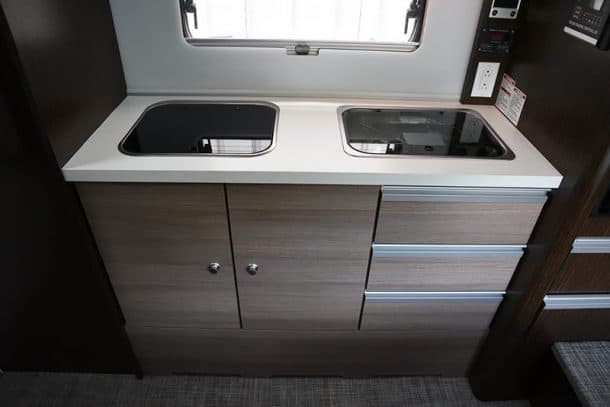
You are a GUI agent. You are given a task and a screenshot of the screen. Output one action in this format:
    pyautogui.click(x=<x>, y=<y>)
    Task: Click on the window
    Image resolution: width=610 pixels, height=407 pixels.
    Given the screenshot: What is the action you would take?
    pyautogui.click(x=291, y=30)